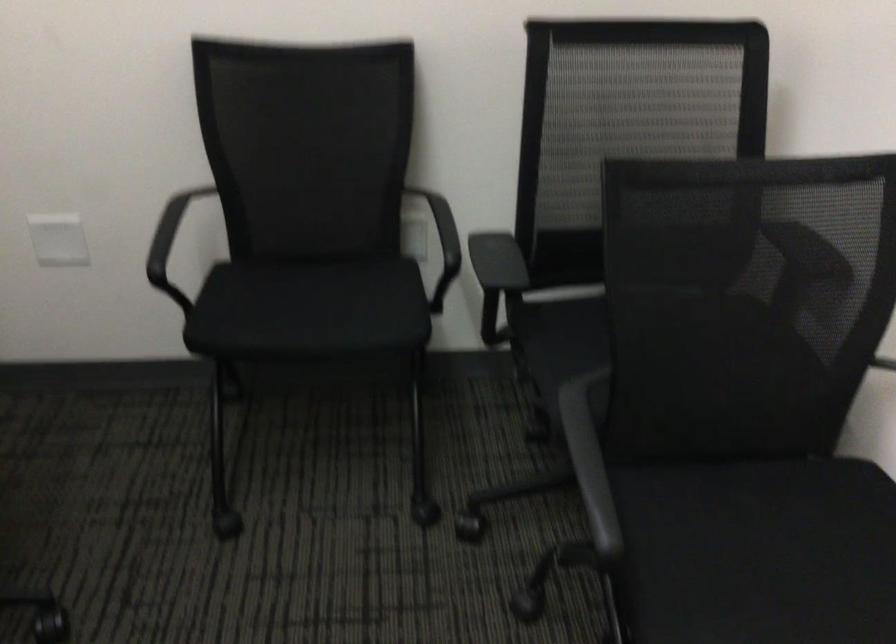
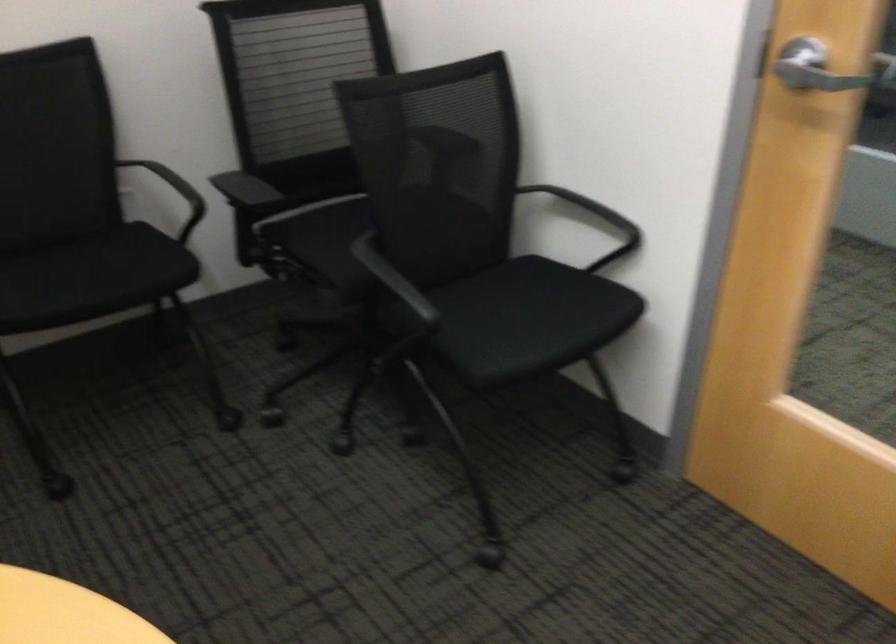
Question: I am providing you with two images of the same scene from different viewpoints. Please identify which objects are invisible in image2.

Choices:
 (A) chair armrest
 (B) silver door handle
 (C) chair sitting surface
 (D) none of these

Answer: (D)